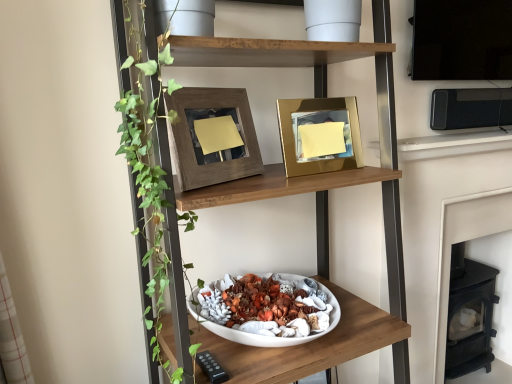
Question: Is gold metallic picture frame at upper center, the first picture frame positioned from the right, to the left of white matte bowl at center, which appears as the second shelf when viewed from the top, from the viewer's perspective?

Choices:
 (A) no
 (B) yes

Answer: (A)

Question: From a real-world perspective, is gold metallic picture frame at upper center, the first picture frame positioned from the right, positioned over white matte bowl at center, which is counted as the first shelf, starting from the bottom, based on gravity?

Choices:
 (A) no
 (B) yes

Answer: (B)

Question: Is gold metallic picture frame at upper center, the second picture frame when ordered from left to right, taller than white matte bowl at center, which is counted as the first shelf, starting from the bottom?

Choices:
 (A) no
 (B) yes

Answer: (B)

Question: Considering the relative positions of gold metallic picture frame at upper center, the first picture frame positioned from the right, and white matte bowl at center, which appears as the second shelf when viewed from the top, in the image provided, is gold metallic picture frame at upper center, the first picture frame positioned from the right, to the right of white matte bowl at center, which appears as the second shelf when viewed from the top, from the viewer's perspective?

Choices:
 (A) yes
 (B) no

Answer: (A)

Question: Is white matte bowl at center, which appears as the second shelf when viewed from the top, a part of gold metallic picture frame at upper center, the first picture frame positioned from the right?

Choices:
 (A) yes
 (B) no

Answer: (B)

Question: Considering the positions of point (471, 117) and point (334, 150), is point (471, 117) closer or farther from the camera than point (334, 150)?

Choices:
 (A) farther
 (B) closer

Answer: (A)

Question: From a real-world perspective, is black plastic microwave at upper right above or below gold metallic picture frame at upper center, the first picture frame positioned from the right?

Choices:
 (A) above
 (B) below

Answer: (A)

Question: In the image, is black plastic microwave at upper right positioned in front of or behind gold metallic picture frame at upper center, the first picture frame positioned from the right?

Choices:
 (A) behind
 (B) front

Answer: (A)

Question: Looking at the image, does black plastic microwave at upper right seem bigger or smaller compared to gold metallic picture frame at upper center, the second picture frame when ordered from left to right?

Choices:
 (A) small
 (B) big

Answer: (B)

Question: Relative to gold metallic picture frame at upper center, the second picture frame when ordered from left to right, is black cast iron fireplace at lower right in front or behind?

Choices:
 (A) behind
 (B) front

Answer: (A)

Question: From the image's perspective, relative to gold metallic picture frame at upper center, the second picture frame when ordered from left to right, is black cast iron fireplace at lower right above or below?

Choices:
 (A) below
 (B) above

Answer: (A)

Question: Considering the positions of point (475, 231) and point (301, 107), is point (475, 231) closer or farther from the camera than point (301, 107)?

Choices:
 (A) closer
 (B) farther

Answer: (B)

Question: Looking at the image, does black cast iron fireplace at lower right seem bigger or smaller compared to gold metallic picture frame at upper center, the second picture frame when ordered from left to right?

Choices:
 (A) big
 (B) small

Answer: (A)

Question: From their relative heights in the image, would you say wooden bowl at center, marked as the first shelf in a top-to-bottom arrangement, is taller or shorter than black plastic microwave at upper right?

Choices:
 (A) tall
 (B) short

Answer: (A)

Question: Based on their sizes in the image, would you say wooden bowl at center, marked as the first shelf in a top-to-bottom arrangement, is bigger or smaller than black plastic microwave at upper right?

Choices:
 (A) big
 (B) small

Answer: (A)